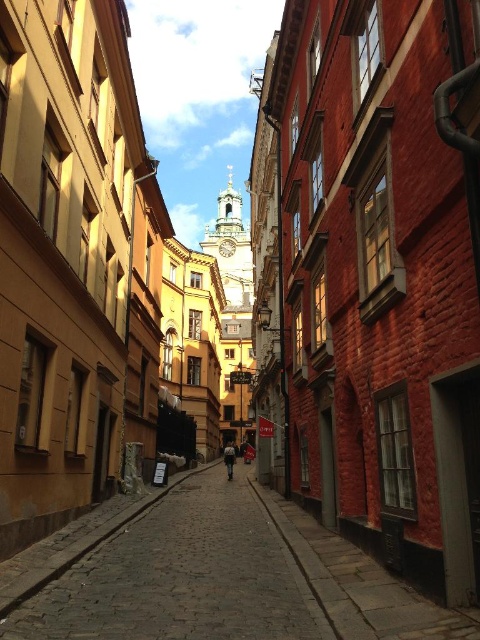
You are a tourist standing at the entrance of the cobblestone alley at center and the dark blue denim jacket at center is in your path. Can you walk through the alley without bending down?

The cobblestone alley at center is shorter than the dark blue denim jacket at center, so the alley is not tall enough for you to walk through without bending down.

You are standing at the entrance of a cobblestone alley in a historic European city. You see a point marked at coordinates (210, 573). Based on the scene description, where is this point located?

The point at coordinates (210, 573) is located at the cobblestone alley at center.

You are standing in the middle of a historic European street. You see a cobblestone alley at center and a dark blue denim jacket at center. Which object is positioned to the right of the other?

The cobblestone alley at center is to the right of dark blue denim jacket at center.